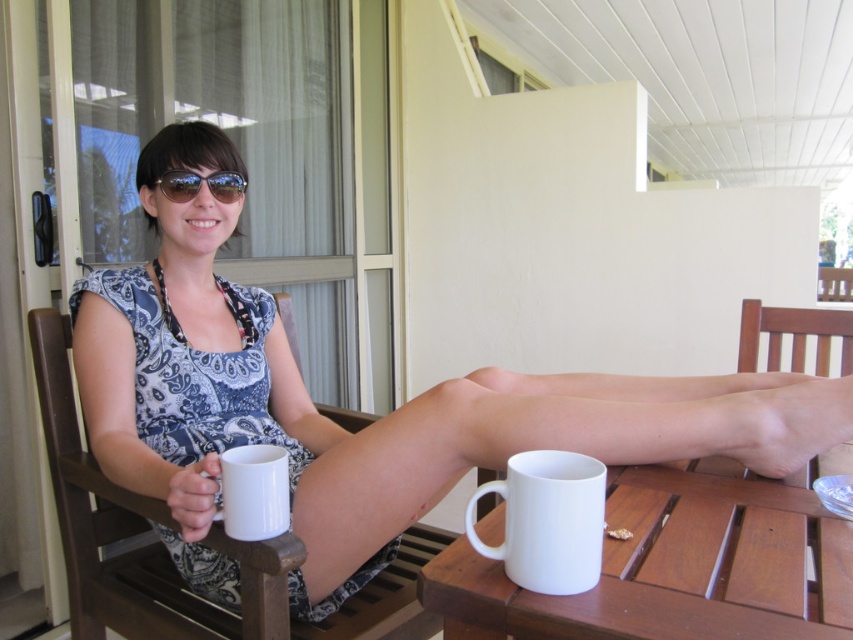
Is white ceramic mug at lower center wider than white ceramic mug at lower left?

Yes, white ceramic mug at lower center is wider than white ceramic mug at lower left.

Does point (576, 520) come behind point (242, 454)?

No, it is not.

The height and width of the screenshot is (640, 853). What do you see at coordinates (547, 520) in the screenshot?
I see `white ceramic mug at lower center` at bounding box center [547, 520].

Image resolution: width=853 pixels, height=640 pixels. In order to click on white ceramic mug at lower center in this screenshot , I will do 547,520.

Which is below, matte fabric dress at center or white ceramic mug at lower left?

Positioned lower is white ceramic mug at lower left.

Is point (323, 477) behind point (235, 465)?

Yes.

Who is more forward, (154,412) or (223,486)?

Point (223,486) is in front.

The width and height of the screenshot is (853, 640). Identify the location of matte fabric dress at center. (374, 420).

Is wooden chair at left behind sunglasses at center?

No, wooden chair at left is in front of sunglasses at center.

In the scene shown: Is wooden chair at left bigger than sunglasses at center?

Yes.

At what (x,y) coordinates should I click in order to perform the action: click on wooden chair at left. Please return your answer as a coordinate pair (x, y). Image resolution: width=853 pixels, height=640 pixels. Looking at the image, I should click on (170, 560).

Identify the location of wooden chair at left. (170, 560).